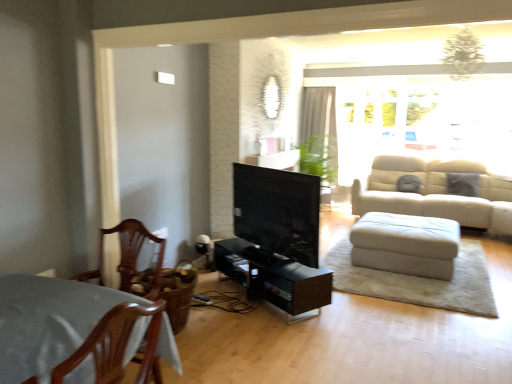
Where is `vacant area that is in front of black glossy entertainment center at center`? vacant area that is in front of black glossy entertainment center at center is located at coordinates (287, 336).